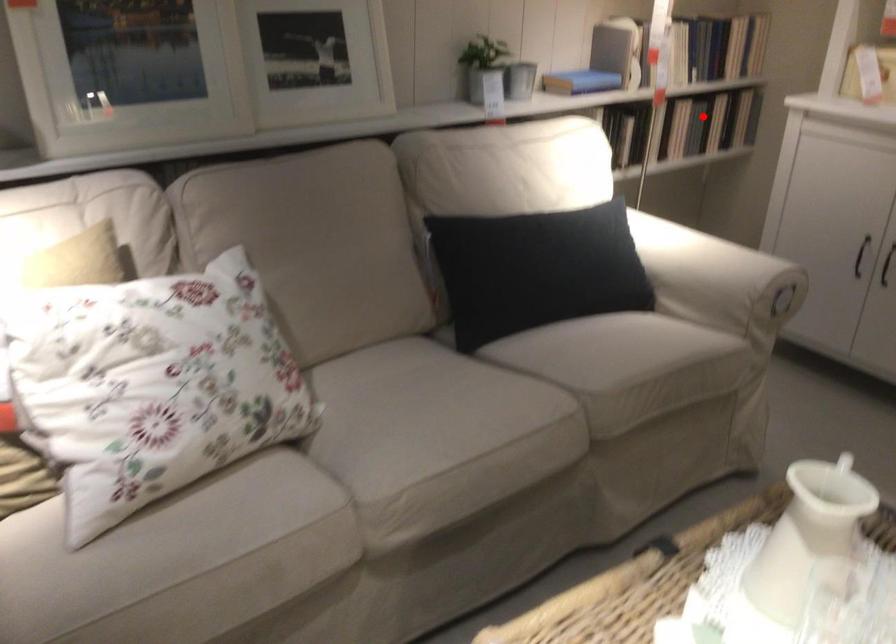
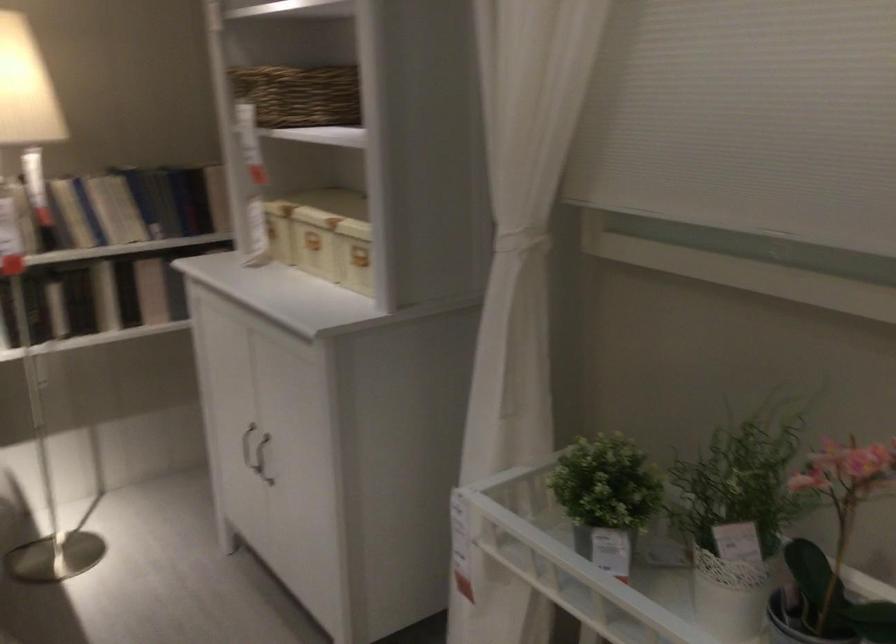
Question: I am providing you with two images of the same scene from different viewpoints. In image1, a red point is highlighted. Considering the same 3D point in image2, which of the following is correct?

Choices:
 (A) It is closer
 (B) It is farther

Answer: (A)